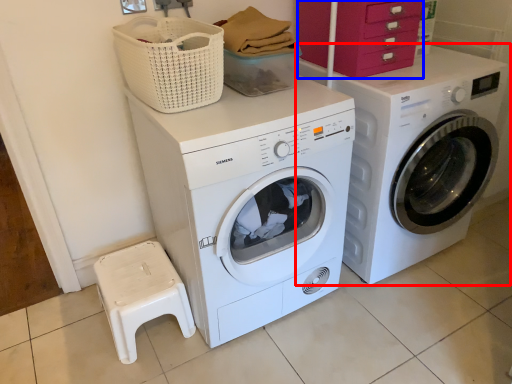
Question: Which of the following is the closest to the observer, washing machine (highlighted by a red box) or drawer (highlighted by a blue box)?

Choices:
 (A) washing machine
 (B) drawer

Answer: (A)